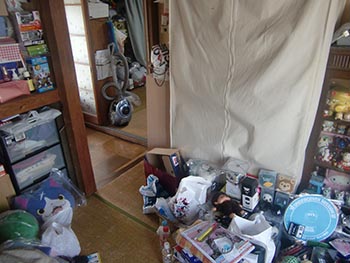
Locate an element on the screen. This screenshot has width=350, height=263. floor is located at coordinates (126, 194), (102, 223).